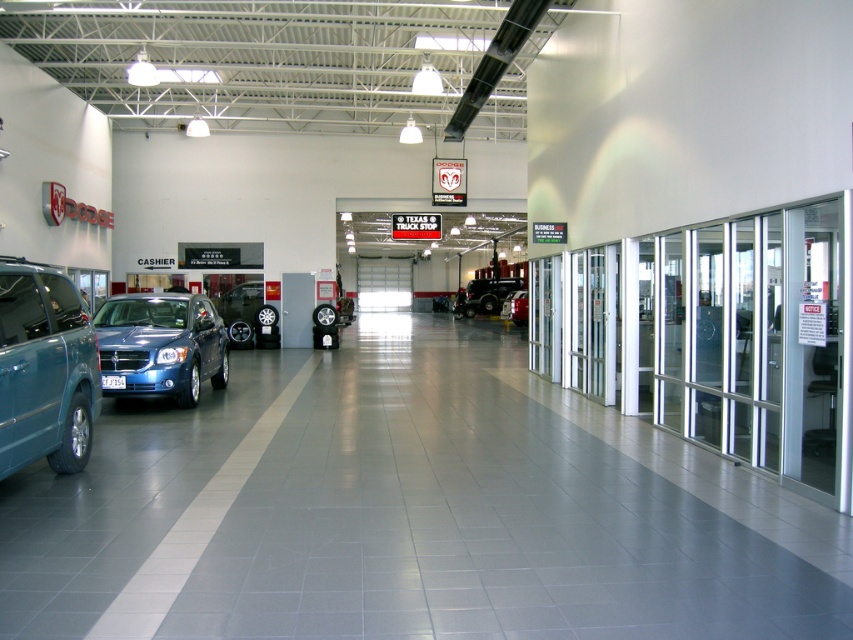
Question: Among these points, which one is farthest from the camera?

Choices:
 (A) (15, 321)
 (B) (474, 296)

Answer: (B)

Question: Can you confirm if matte black suv at left is positioned to the left of matte blue suv at center-left?

Choices:
 (A) no
 (B) yes

Answer: (A)

Question: Observing the image, what is the correct spatial positioning of matte black suv at left in reference to matte blue sedan at center?

Choices:
 (A) above
 (B) below

Answer: (B)

Question: Which of the following is the farthest from the observer?

Choices:
 (A) matte blue suv at center-left
 (B) matte black suv at left
 (C) metallic silver car at center

Answer: (C)

Question: Which of these objects is positioned closest to the matte black suv at left?

Choices:
 (A) matte blue suv at center-left
 (B) matte blue sedan at center
 (C) metallic silver car at center
 (D) matte black truck at center

Answer: (A)

Question: Does matte blue suv at center-left have a larger size compared to metallic silver car at center?

Choices:
 (A) no
 (B) yes

Answer: (B)